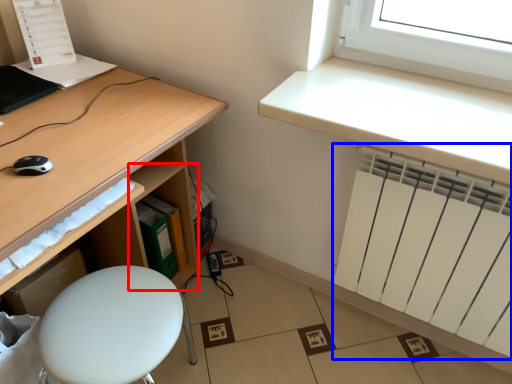
Question: Which of the following is the farthest to the observer, shelf (highlighted by a red box) or radiator (highlighted by a blue box)?

Choices:
 (A) shelf
 (B) radiator

Answer: (A)